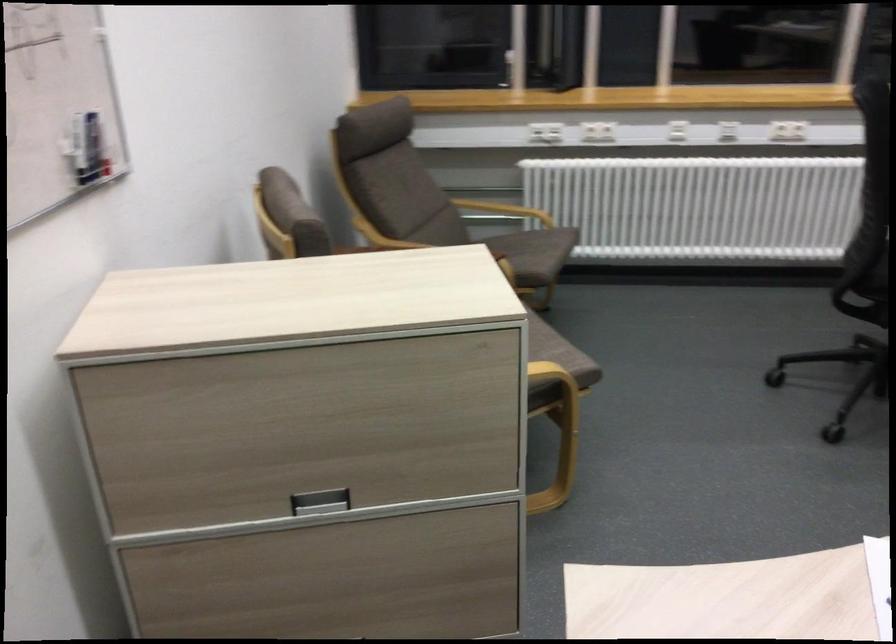
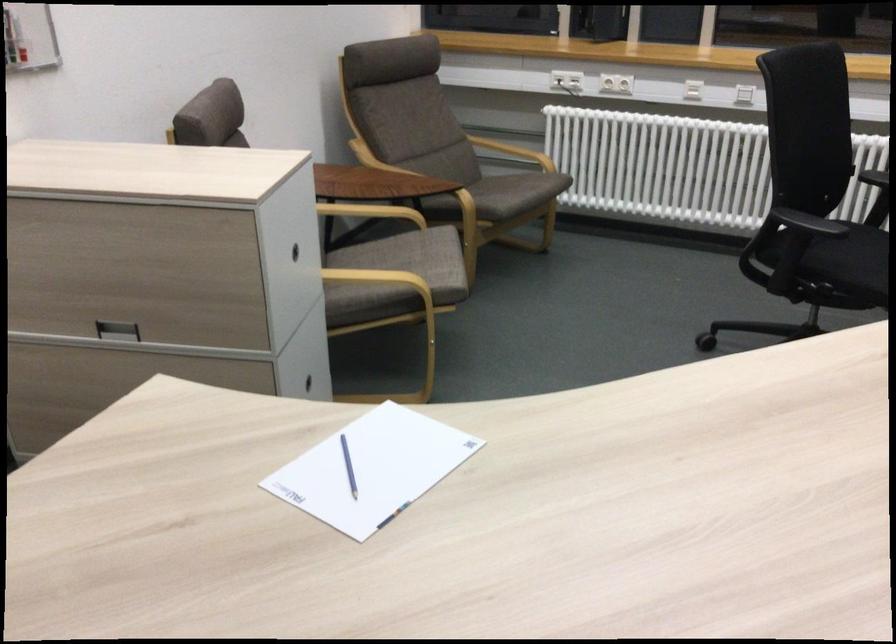
The point at (606,128) is marked in the first image. Where is the corresponding point in the second image?

(616, 82)